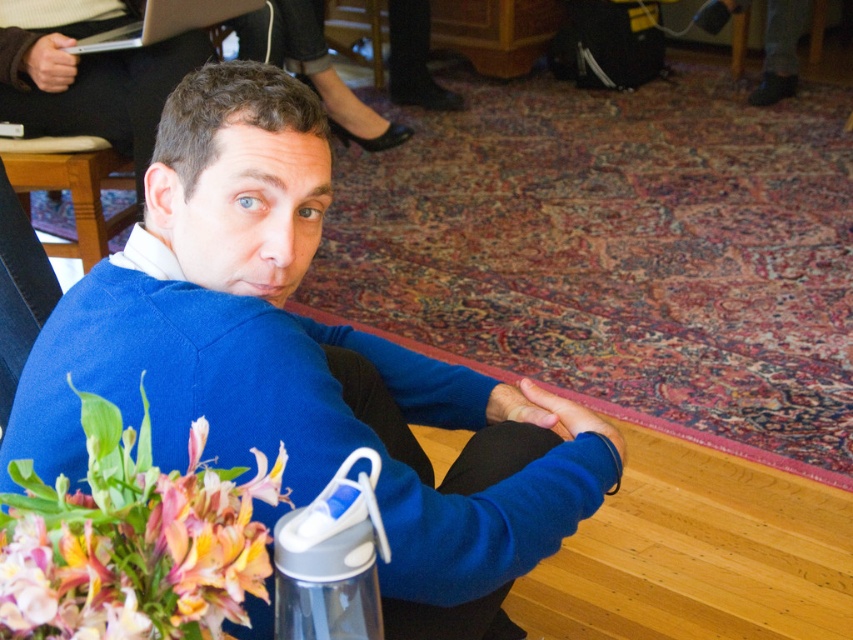
Consider the image. Does blue matte sweater at center have a lesser width compared to matte black armchair at upper center?

No.

Who is more distant from viewer, (28, 380) or (376, 22)?

The point (376, 22) is behind.

Which is in front, point (498, 588) or point (352, 4)?

Positioned in front is point (498, 588).

I want to click on blue matte sweater at center, so click(302, 365).

Does black leather armchair at left have a greater height compared to matte black armchair at upper center?

No, black leather armchair at left is not taller than matte black armchair at upper center.

Does black leather armchair at left have a smaller size compared to matte black armchair at upper center?

Actually, black leather armchair at left might be larger than matte black armchair at upper center.

Between point (86, 150) and point (383, 10), which one is positioned in front?

Point (86, 150) is more forward.

Locate an element on the screen. This screenshot has width=853, height=640. black leather armchair at left is located at coordinates (71, 186).

Is black leather armchair at left smaller than silver metallic laptop at upper left?

No.

Does point (126, 184) come closer to viewer compared to point (222, 4)?

No.

This screenshot has width=853, height=640. I want to click on black leather armchair at left, so click(x=71, y=186).